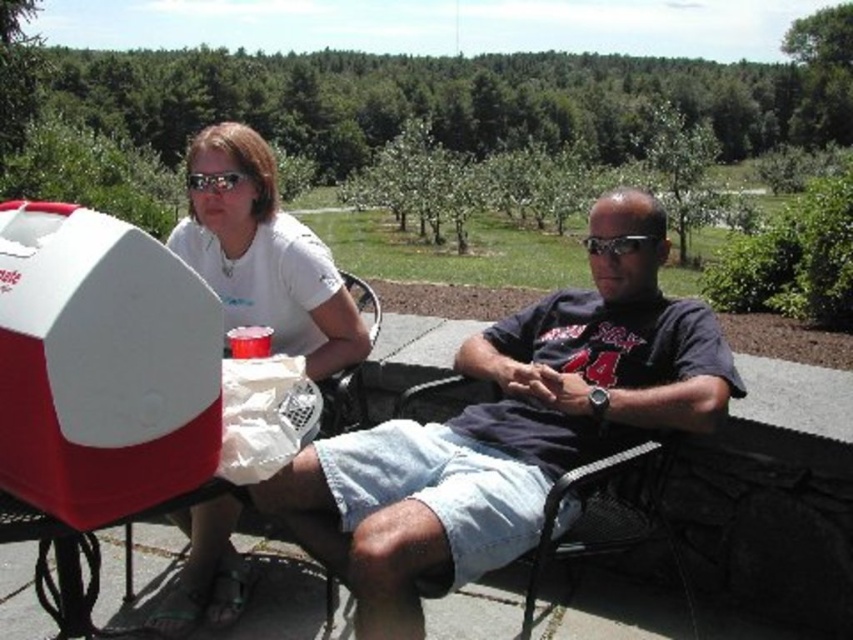
Question: Is denim shorts at center smaller than white matte t-shirt at upper left?

Choices:
 (A) no
 (B) yes

Answer: (B)

Question: Which point is closer to the camera taking this photo?

Choices:
 (A) (225, 513)
 (B) (560, 326)

Answer: (A)

Question: Where is denim shorts at center located in relation to white matte t-shirt at upper left in the image?

Choices:
 (A) right
 (B) left

Answer: (A)

Question: Which of the following is the closest to the observer?

Choices:
 (A) (350, 317)
 (B) (486, 328)

Answer: (A)

Question: Which point is farther from the camera taking this photo?

Choices:
 (A) (219, 582)
 (B) (433, 560)

Answer: (A)

Question: Can you confirm if denim shorts at center is positioned above white matte t-shirt at upper left?

Choices:
 (A) no
 (B) yes

Answer: (A)